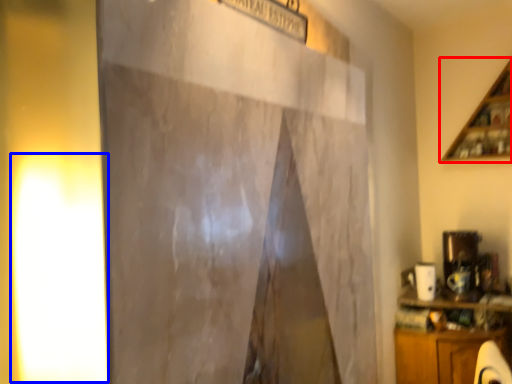
Question: Which point is further to the camera, shelf (highlighted by a red box) or light (highlighted by a blue box)?

Choices:
 (A) shelf
 (B) light

Answer: (A)